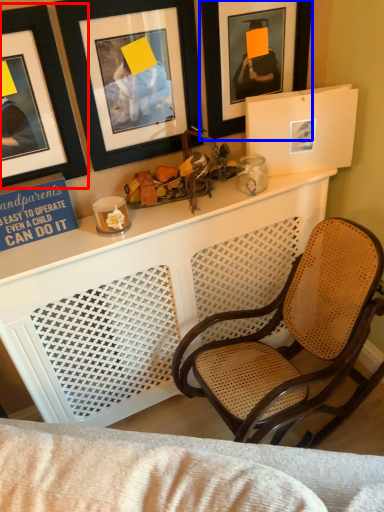
Question: Which of the following is the closest to the observer, picture frame (highlighted by a red box) or picture frame (highlighted by a blue box)?

Choices:
 (A) picture frame
 (B) picture frame

Answer: (A)